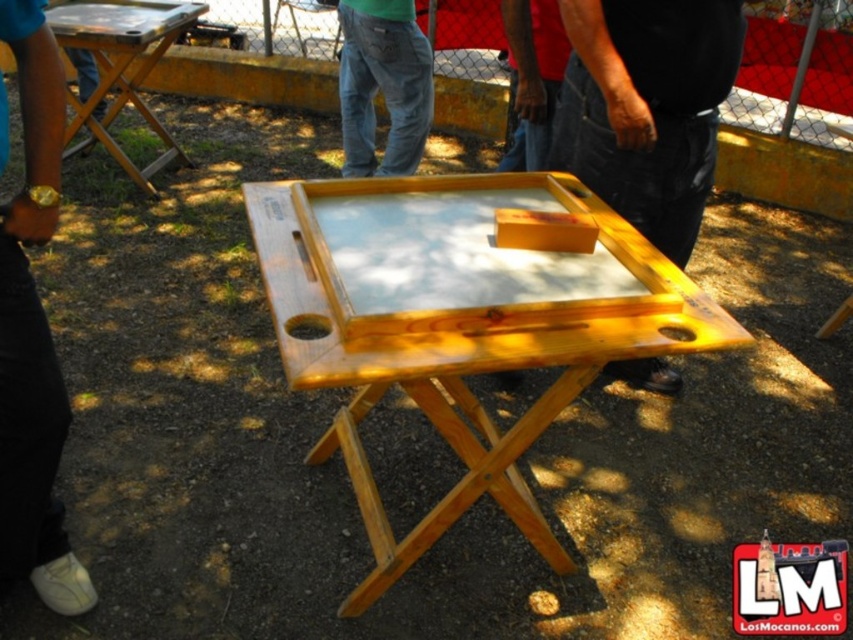
You are sitting at the wooden folding table and want to reach for your phone which is on the table. Your denim pants at center are in your lap, and you notice the black leather wristwatch at lower left on the ground next to your left foot. Which item is closer to your left hand?

The black leather wristwatch at lower left is closer to your left hand because it is positioned to the left of the denim pants at center, which are in your lap.

You are a person standing near the wooden folding table. You notice the black leather wristwatch at lower left and the denim pants at center. Which object is narrower in width?

The black leather wristwatch at lower left has a lesser width compared to the denim pants at center, so the black leather wristwatch at lower left is narrower.

You are standing at the center of the wooden folding table and want to place your hand to reach the black leather wristwatch at lower left. Based on the table setup, where should you move your hand relative to the table?

The black leather wristwatch at lower left is located at the lower left position on the table, so you should move your hand towards the lower left direction from the center of the wooden folding table to reach it.